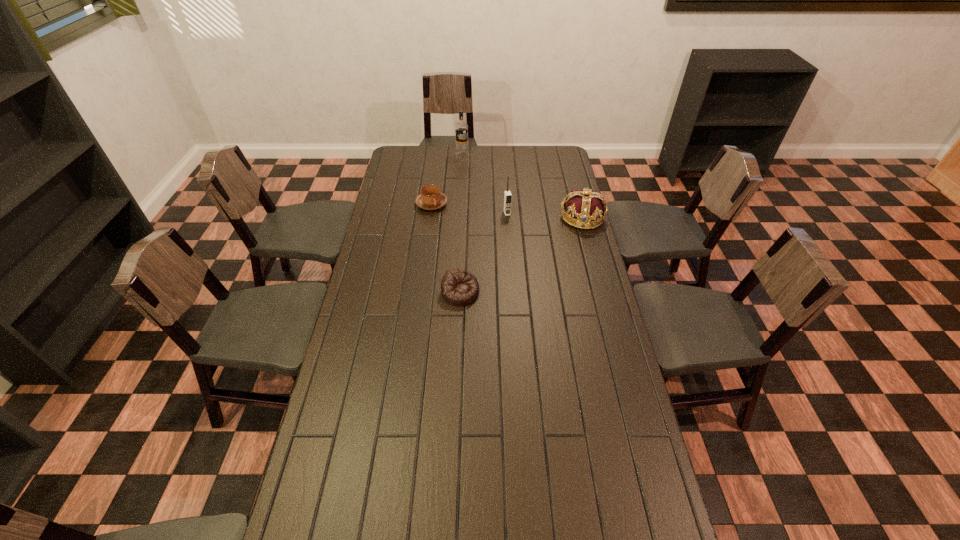
Find the location of a particular element. object at the left edge is located at coordinates (431, 198).

This screenshot has height=540, width=960. Identify the location of object situated at the right edge. (586, 207).

In the image, there is a desktop. Where is `vacant space at the far edge`? This screenshot has height=540, width=960. vacant space at the far edge is located at coordinates (435, 146).

The image size is (960, 540). What are the coordinates of `free space at the near edge of the desktop` in the screenshot? It's located at (517, 496).

This screenshot has width=960, height=540. Find the location of `free region at the left edge of the desktop`. free region at the left edge of the desktop is located at coordinates (373, 357).

This screenshot has height=540, width=960. Find the location of `blank space at the right edge of the desktop`. blank space at the right edge of the desktop is located at coordinates (626, 449).

In the image, there is a desktop. What are the coordinates of `vacant space at the near left corner` in the screenshot? It's located at [x=355, y=517].

What are the coordinates of `vacant space in between the third tallest object and the cellular telephone` in the screenshot? It's located at (544, 215).

Locate an element on the screen. The height and width of the screenshot is (540, 960). free space between the cappuccino and the farthest object is located at coordinates (447, 179).

Find the location of a particular element. The width and height of the screenshot is (960, 540). free spot between the rightmost object and the beanbag is located at coordinates (521, 255).